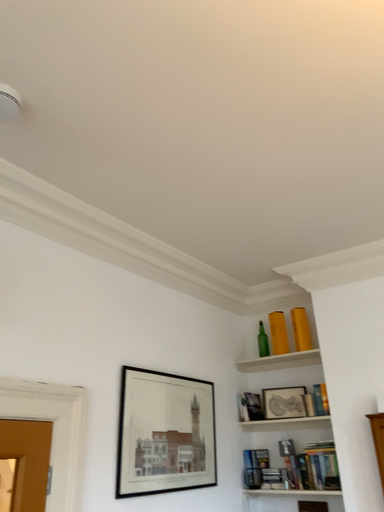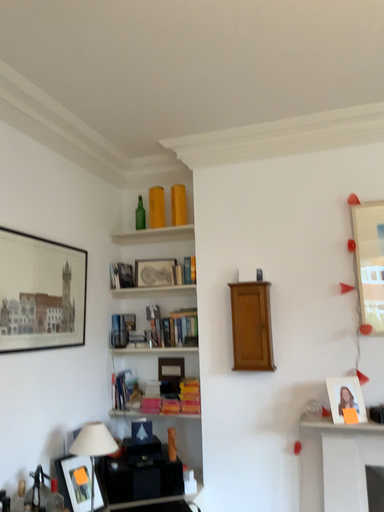
Question: How did the camera likely rotate when shooting the video?

Choices:
 (A) rotated upward
 (B) rotated downward

Answer: (B)